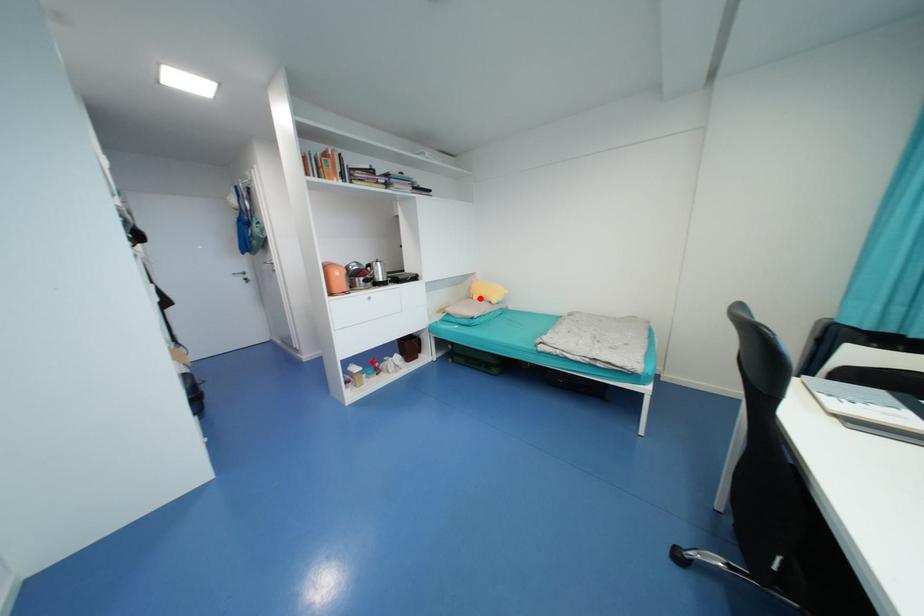
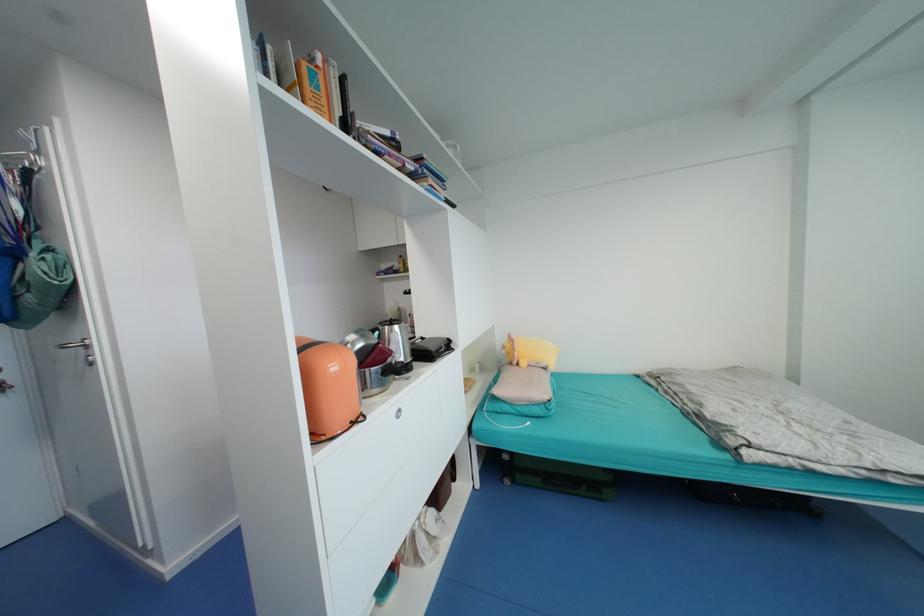
Find the pixel in the second image that matches the highlighted location in the first image.

(529, 365)